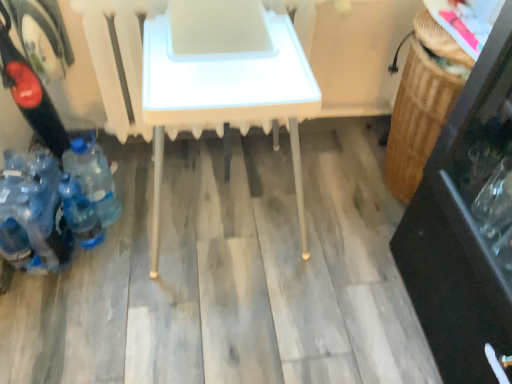
Question: Is blue plastic bottle at lower left, the 2th bottle positioned from the right, bigger than blue plastic bottles at lower left, the first bottle in the left-to-right sequence?

Choices:
 (A) no
 (B) yes

Answer: (A)

Question: Is blue plastic bottles at lower left, the 3th bottle positioned from the right, completely or partially inside blue plastic bottle at lower left, the 2th bottle positioned from the right?

Choices:
 (A) yes
 (B) no

Answer: (B)

Question: Is blue plastic bottle at lower left, which is counted as the second bottle, starting from the left, closer to camera compared to blue plastic bottles at lower left, the 3th bottle positioned from the right?

Choices:
 (A) no
 (B) yes

Answer: (A)

Question: Considering the relative positions of blue plastic bottle at lower left, which is counted as the second bottle, starting from the left, and blue plastic bottles at lower left, the first bottle in the left-to-right sequence, in the image provided, is blue plastic bottle at lower left, which is counted as the second bottle, starting from the left, to the right of blue plastic bottles at lower left, the first bottle in the left-to-right sequence, from the viewer's perspective?

Choices:
 (A) yes
 (B) no

Answer: (A)

Question: From a real-world perspective, is blue plastic bottle at lower left, the 2th bottle positioned from the right, physically below blue plastic bottles at lower left, the 3th bottle positioned from the right?

Choices:
 (A) no
 (B) yes

Answer: (B)

Question: In the image, is blue plastic bottle at lower left, the 2th bottle positioned from the right, on the left side or the right side of blue plastic bottle at lower left, the 3th bottle positioned from the left?

Choices:
 (A) right
 (B) left

Answer: (B)

Question: From the image's perspective, is blue plastic bottle at lower left, the 2th bottle positioned from the right, above or below blue plastic bottle at lower left, the 3th bottle positioned from the left?

Choices:
 (A) below
 (B) above

Answer: (A)

Question: In terms of height, does blue plastic bottle at lower left, which is counted as the second bottle, starting from the left, look taller or shorter compared to blue plastic bottle at lower left, the 3th bottle positioned from the left?

Choices:
 (A) short
 (B) tall

Answer: (A)

Question: Is point (90, 246) positioned closer to the camera than point (114, 195)?

Choices:
 (A) farther
 (B) closer

Answer: (B)

Question: Which is correct: blue plastic bottle at lower left, the 3th bottle positioned from the left, is inside blue plastic bottle at lower left, which is counted as the second bottle, starting from the left, or outside of it?

Choices:
 (A) outside
 (B) inside

Answer: (A)

Question: Considering the positions of blue plastic bottle at lower left, the 3th bottle positioned from the left, and blue plastic bottle at lower left, which is counted as the second bottle, starting from the left, in the image, is blue plastic bottle at lower left, the 3th bottle positioned from the left, wider or thinner than blue plastic bottle at lower left, which is counted as the second bottle, starting from the left,?

Choices:
 (A) wide
 (B) thin

Answer: (A)

Question: Looking at the image, does blue plastic bottle at lower left, the 3th bottle positioned from the left, seem bigger or smaller compared to blue plastic bottle at lower left, which is counted as the second bottle, starting from the left?

Choices:
 (A) small
 (B) big

Answer: (B)

Question: Is blue plastic bottle at lower left, arranged as the first bottle when viewed from the right, to the left or to the right of blue plastic bottle at lower left, which is counted as the second bottle, starting from the left, in the image?

Choices:
 (A) left
 (B) right

Answer: (B)

Question: In the image, is blue plastic bottle at lower left, the 2th bottle positioned from the right, positioned in front of or behind white plastic table at center?

Choices:
 (A) behind
 (B) front

Answer: (A)

Question: From a real-world perspective, is blue plastic bottle at lower left, the 2th bottle positioned from the right, physically located above or below white plastic table at center?

Choices:
 (A) above
 (B) below

Answer: (B)